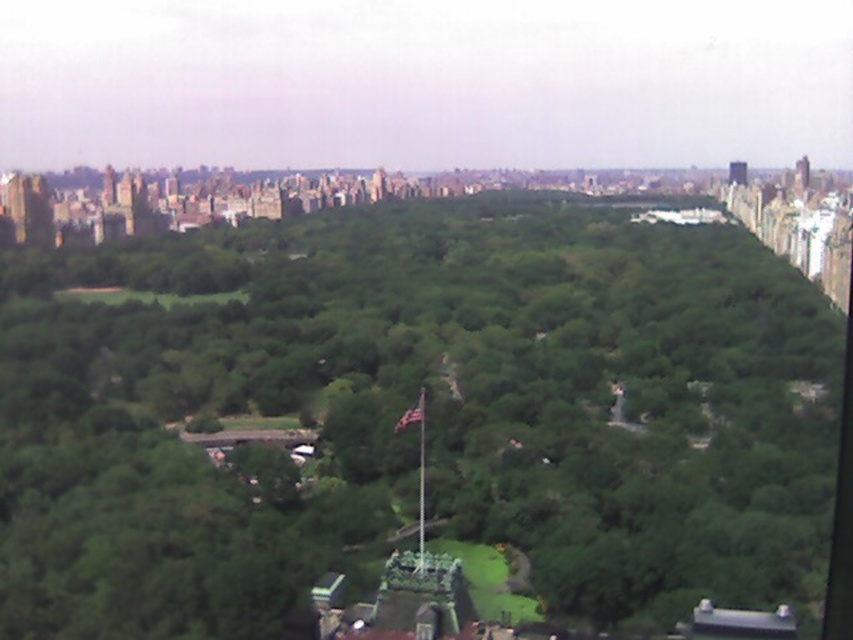
In the scene shown: Which of these two, dark gray stone tower at upper right or smooth glass tower at upper right, stands taller?

dark gray stone tower at upper right is taller.

Who is lower down, dark gray stone tower at upper right or smooth glass tower at upper right?

smooth glass tower at upper right

Which is behind, point (799, 182) or point (746, 163)?

The point (799, 182) is more distant.

Find the location of `dark gray stone tower at upper right`. dark gray stone tower at upper right is located at coordinates click(801, 173).

Can you confirm if green leafy trees at center is positioned above smooth glass tower at upper right?

Incorrect, green leafy trees at center is not positioned above smooth glass tower at upper right.

Find the location of a particular element. The width and height of the screenshot is (853, 640). green leafy trees at center is located at coordinates (427, 413).

Which is in front, point (350, 264) or point (734, 180)?

Point (350, 264)

Locate an element on the screen. This screenshot has width=853, height=640. green leafy trees at center is located at coordinates (427, 413).

Does green leafy trees at center have a lesser height compared to dark gray stone tower at upper right?

No, green leafy trees at center is not shorter than dark gray stone tower at upper right.

Is green leafy trees at center above dark gray stone tower at upper right?

No.

Is point (41, 596) farther from viewer compared to point (805, 173)?

No, it is in front of (805, 173).

The height and width of the screenshot is (640, 853). In order to click on green leafy trees at center in this screenshot , I will do `click(427, 413)`.